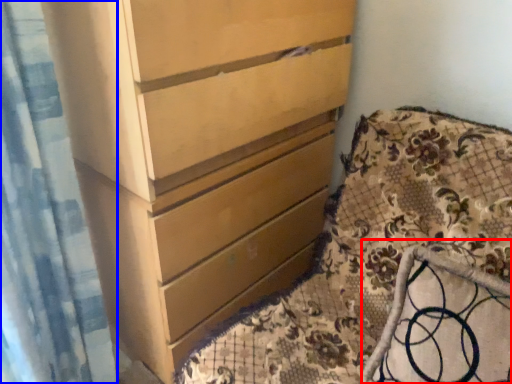
Question: Which object is closer to the camera taking this photo, rocking chair (highlighted by a red box) or shower curtain (highlighted by a blue box)?

Choices:
 (A) rocking chair
 (B) shower curtain

Answer: (A)